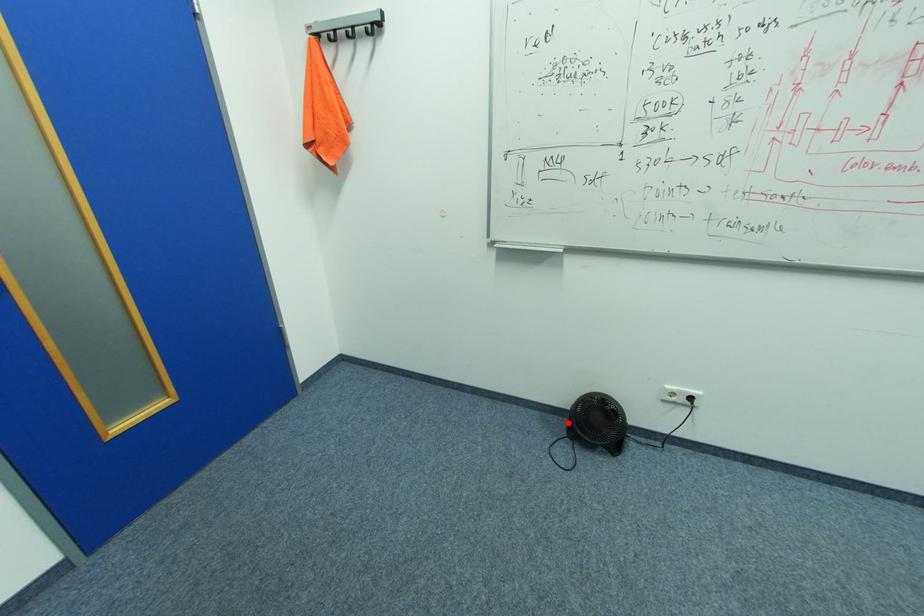
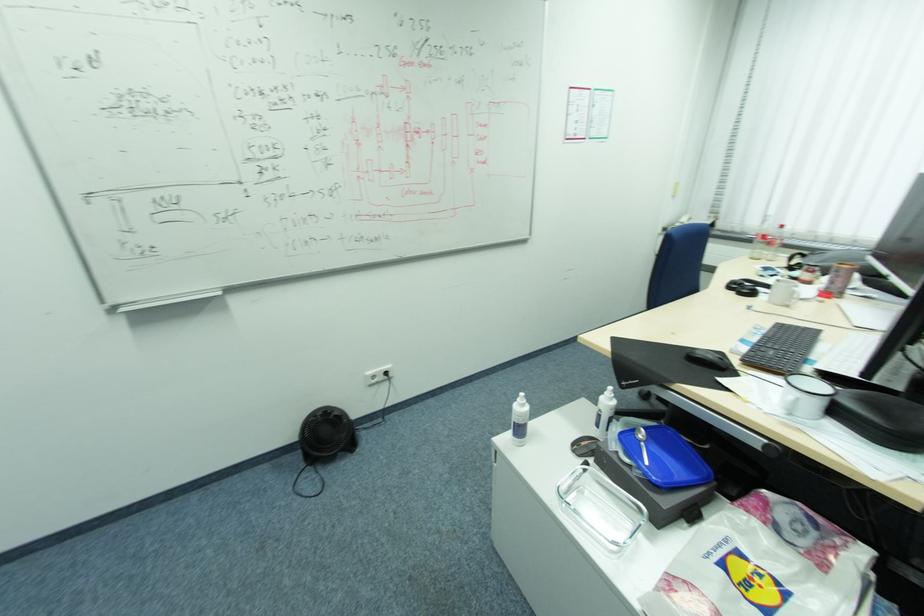
Question: A red point is marked in image1. In image2, is the corresponding 3D point closer to the camera or farther? Reply with the corresponding letter.

Choices:
 (A) The corresponding 3D point is closer.
 (B) The corresponding 3D point is farther.

Answer: (B)